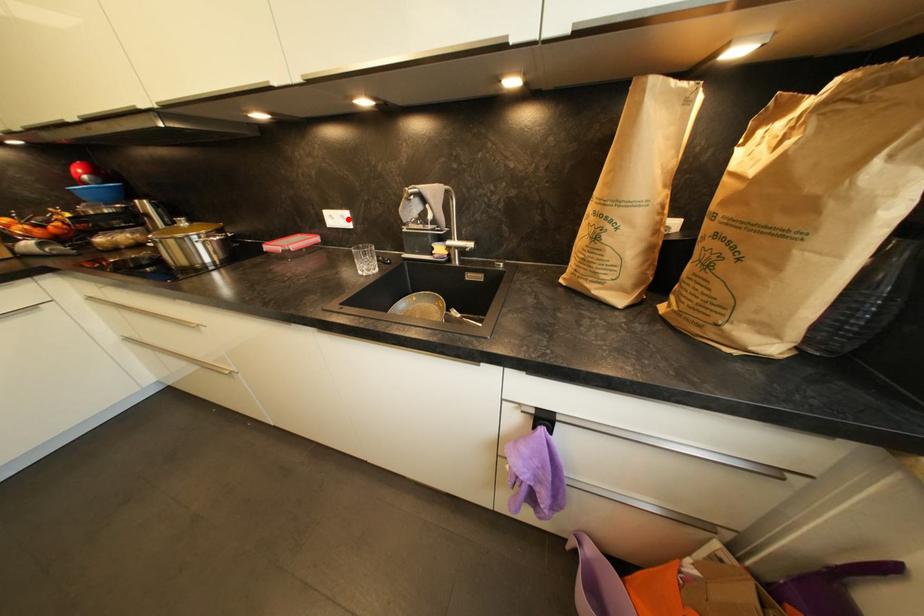
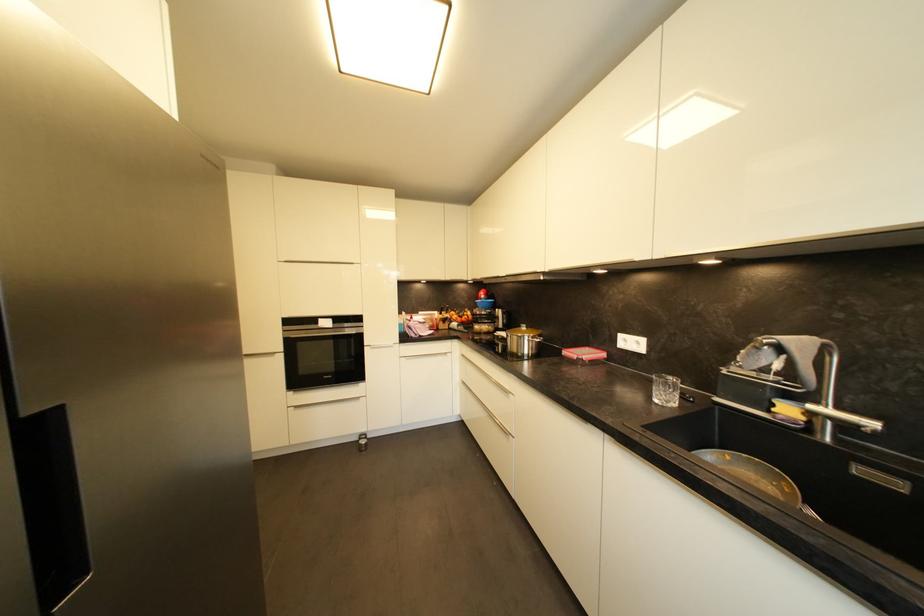
The point at the highlighted location is marked in the first image. Where is the corresponding point in the second image?

(642, 345)